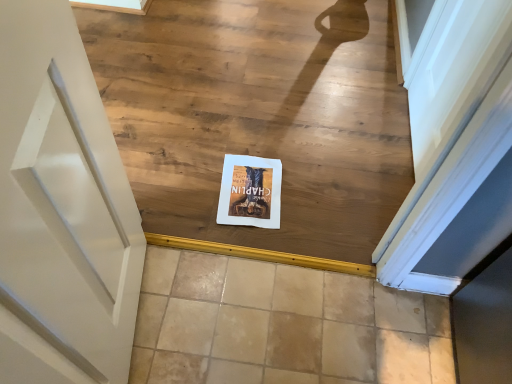
Identify the location of vacant area on top of beige tile at center (from a real-world perspective). (296, 328).